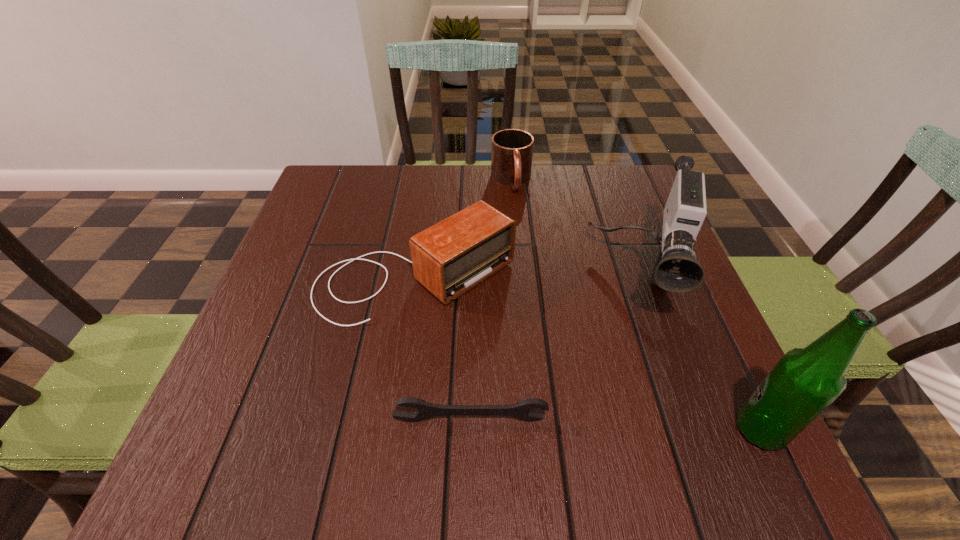
Locate an element on the screen. vacant area in the image that satisfies the following two spatial constraints: 1. on the open ends of the wrench; 2. on the label of the tallest object is located at coordinates (470, 430).

At what (x,y) coordinates should I click in order to perform the action: click on free space that satisfies the following two spatial constraints: 1. on the front side of the tallest object; 2. on the label of the radio receiver. Please return your answer as a coordinate pair (x, y). The width and height of the screenshot is (960, 540). Looking at the image, I should click on (394, 430).

Identify the location of free space that satisfies the following two spatial constraints: 1. on the open ends of the beer bottle; 2. on the label of the wrench. This screenshot has height=540, width=960. (470, 430).

Where is `free location that satisfies the following two spatial constraints: 1. on the open ends of the wrench; 2. on the label of the beer bottle`? free location that satisfies the following two spatial constraints: 1. on the open ends of the wrench; 2. on the label of the beer bottle is located at coordinates (470, 430).

Identify the location of free space that satisfies the following two spatial constraints: 1. on the front side of the farthest object; 2. on the label of the beer bottle. This screenshot has height=540, width=960. (534, 430).

Find the location of a particular element. This screenshot has height=540, width=960. vacant space that satisfies the following two spatial constraints: 1. on the open ends of the tallest object; 2. on the label of the shortest object is located at coordinates (470, 430).

Locate an element on the screen. free region that satisfies the following two spatial constraints: 1. on the back side of the farthest object; 2. on the right side of the radio receiver is located at coordinates (429, 181).

Locate an element on the screen. blank area in the image that satisfies the following two spatial constraints: 1. on the open ends of the wrench; 2. on the label of the tallest object is located at coordinates (x=470, y=430).